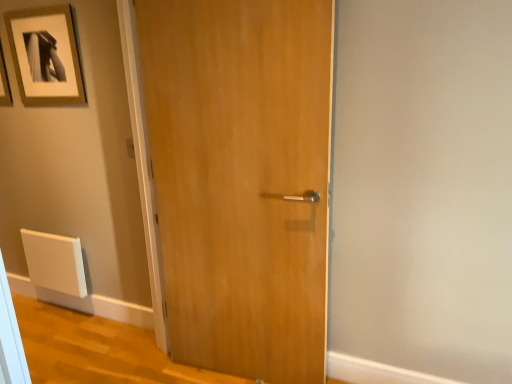
Question: Would you say matte gold picture frame at upper left is to the left or to the right of wooden door at center in the picture?

Choices:
 (A) left
 (B) right

Answer: (A)

Question: From a real-world perspective, is matte gold picture frame at upper left physically located above or below wooden door at center?

Choices:
 (A) above
 (B) below

Answer: (A)

Question: From the image's perspective, relative to wooden door at center, is matte gold picture frame at upper left above or below?

Choices:
 (A) below
 (B) above

Answer: (B)

Question: Would you say wooden door at center is to the left or to the right of matte gold picture frame at upper left in the picture?

Choices:
 (A) right
 (B) left

Answer: (A)

Question: Relative to matte gold picture frame at upper left, is wooden door at center in front or behind?

Choices:
 (A) front
 (B) behind

Answer: (A)

Question: Based on their sizes in the image, would you say wooden door at center is bigger or smaller than matte gold picture frame at upper left?

Choices:
 (A) small
 (B) big

Answer: (B)

Question: Is point (172, 23) closer or farther from the camera than point (59, 64)?

Choices:
 (A) closer
 (B) farther

Answer: (A)